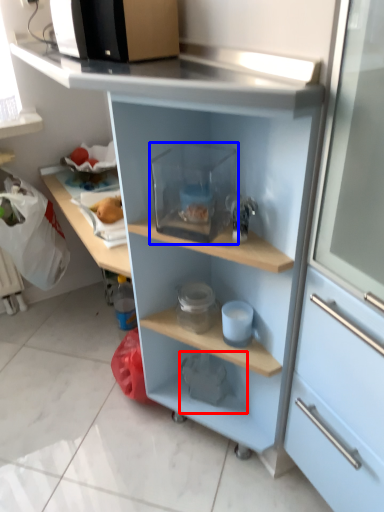
Question: Which object is closer to the camera taking this photo, appliance (highlighted by a red box) or appliance (highlighted by a blue box)?

Choices:
 (A) appliance
 (B) appliance

Answer: (B)